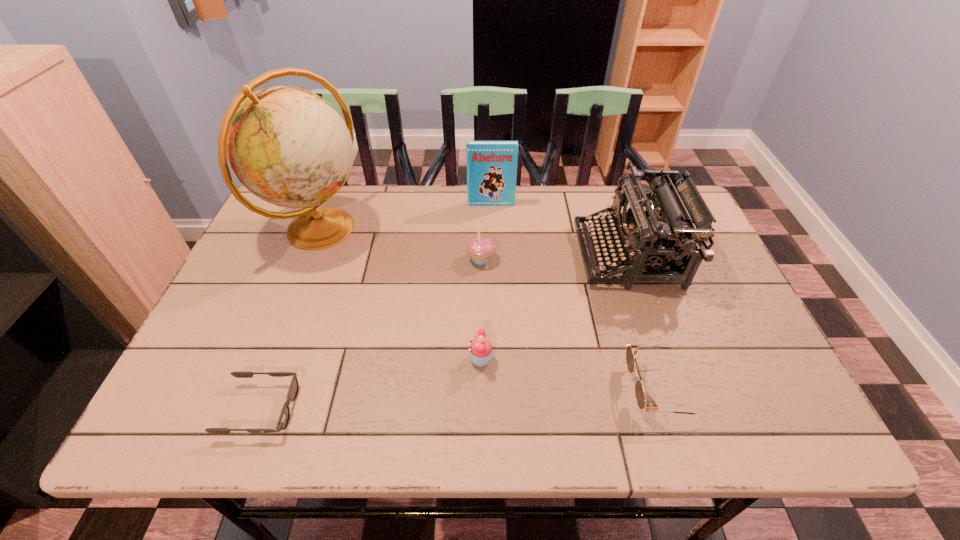
Where is `vacant space located 0.140m on the front lenses of the taller sunglasses`? The height and width of the screenshot is (540, 960). vacant space located 0.140m on the front lenses of the taller sunglasses is located at coordinates (562, 389).

Image resolution: width=960 pixels, height=540 pixels. Find the location of `blank space located on the temples of the left sunglasses`. blank space located on the temples of the left sunglasses is located at coordinates (444, 409).

Where is `globe that is at the far edge`? The image size is (960, 540). globe that is at the far edge is located at coordinates (288, 146).

The height and width of the screenshot is (540, 960). I want to click on book located at the far edge, so click(491, 165).

Find the location of a particular element. typewriter located at the far edge is located at coordinates (651, 238).

The height and width of the screenshot is (540, 960). What are the coordinates of `globe at the left edge` in the screenshot? It's located at tap(288, 146).

Find the location of a particular element. This screenshot has width=960, height=540. sunglasses located in the left edge section of the desktop is located at coordinates (283, 420).

You are a GUI agent. You are given a task and a screenshot of the screen. Output one action in this format:
    pyautogui.click(x=<x>, y=<y>)
    Task: Click on the object at the right edge
    This screenshot has width=960, height=540.
    Given the screenshot: What is the action you would take?
    pyautogui.click(x=651, y=238)

At what (x,y) coordinates should I click in order to perform the action: click on object located in the far left corner section of the desktop. Please return your answer as a coordinate pair (x, y). The height and width of the screenshot is (540, 960). Looking at the image, I should click on (288, 146).

The width and height of the screenshot is (960, 540). What are the coordinates of `object at the near left corner` in the screenshot? It's located at [283, 420].